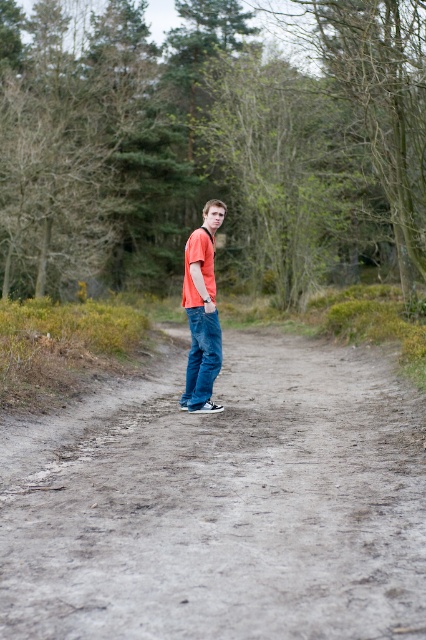
You are standing at the coordinates 0.0, 0.0 and want to walk to the dull gray dirt track at center. Which direction should you move in?

The dull gray dirt track at center is located at coordinates (x=221, y=504), so you should move in the positive x and y direction to reach it.